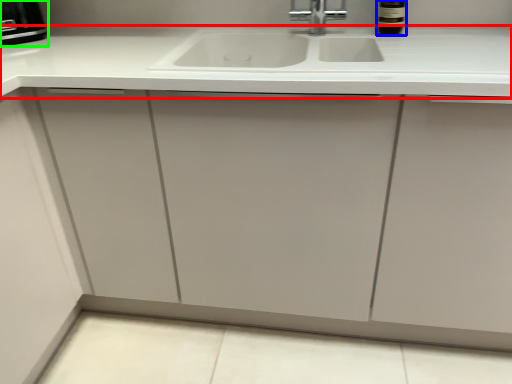
Question: Which is nearer to the countertop (highlighted by a red box)? wine bottle (highlighted by a blue box) or appliance (highlighted by a green box).

Choices:
 (A) wine bottle
 (B) appliance

Answer: (A)